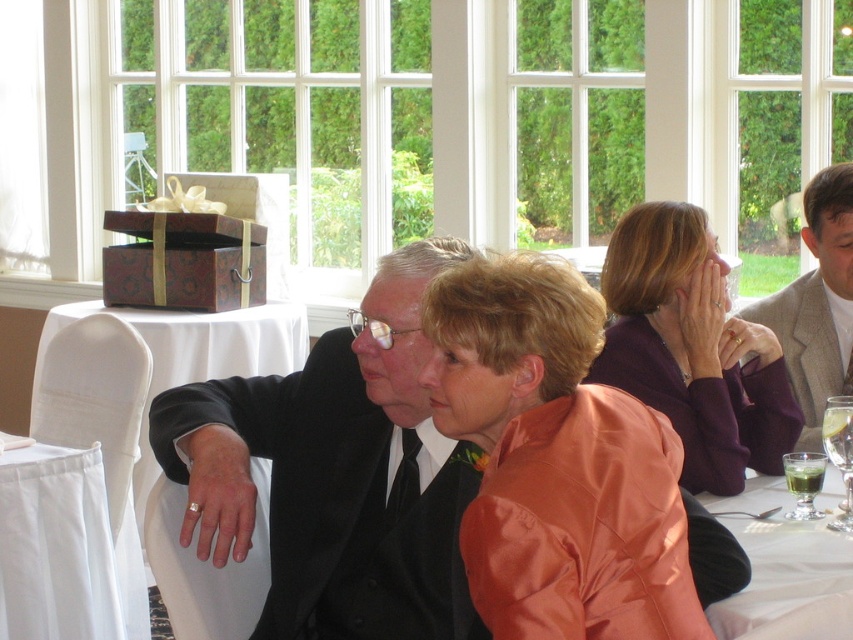
Which is more to the right, gray wool suit at right or green translucent glass at lower right?

Positioned to the right is gray wool suit at right.

Is point (850, 196) farther from camera compared to point (825, 460)?

Yes, it is behind point (825, 460).

Where is `gray wool suit at right`? The height and width of the screenshot is (640, 853). gray wool suit at right is located at coordinates (817, 304).

Between point (416, 461) and point (834, 380), which one is positioned in front?

Positioned in front is point (416, 461).

Measure the distance between black satin suit at center and gray wool suit at right.

black satin suit at center is 4.73 feet away from gray wool suit at right.

Identify the location of black satin suit at center. This screenshot has width=853, height=640. (335, 474).

Is point (630, 276) closer to viewer compared to point (839, 428)?

No.

This screenshot has height=640, width=853. Find the location of `purple satin jacket at center`. purple satin jacket at center is located at coordinates (692, 348).

At what (x,y) coordinates should I click in order to perform the action: click on purple satin jacket at center. Please return your answer as a coordinate pair (x, y). Looking at the image, I should click on (692, 348).

The width and height of the screenshot is (853, 640). Identify the location of purple satin jacket at center. (692, 348).